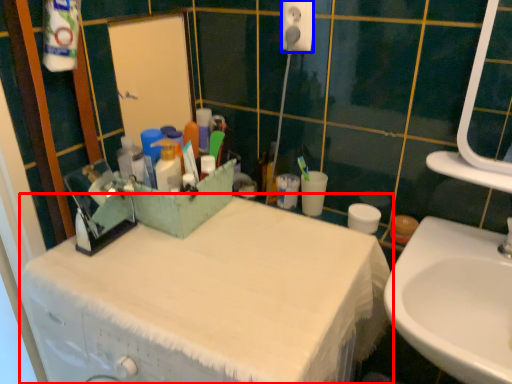
Question: Which point is further to the camera, bathroom cabinet (highlighted by a red box) or electric outlet (highlighted by a blue box)?

Choices:
 (A) bathroom cabinet
 (B) electric outlet

Answer: (B)